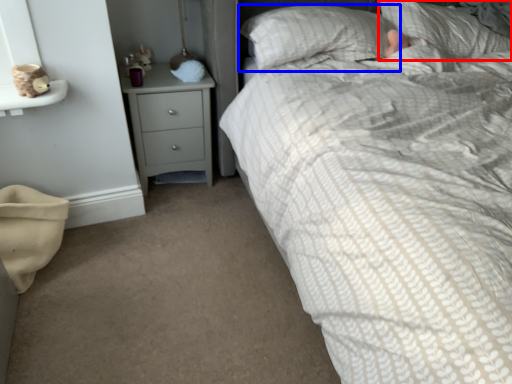
Question: Which of the following is the closest to the observer, pillow (highlighted by a red box) or pillow (highlighted by a blue box)?

Choices:
 (A) pillow
 (B) pillow

Answer: (B)